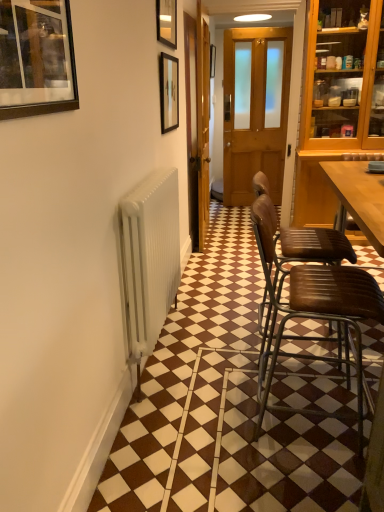
This screenshot has height=512, width=384. I want to click on vacant area that is in front of brown leather chair at right, which appears as the 2th chair when viewed from the back, so click(x=298, y=476).